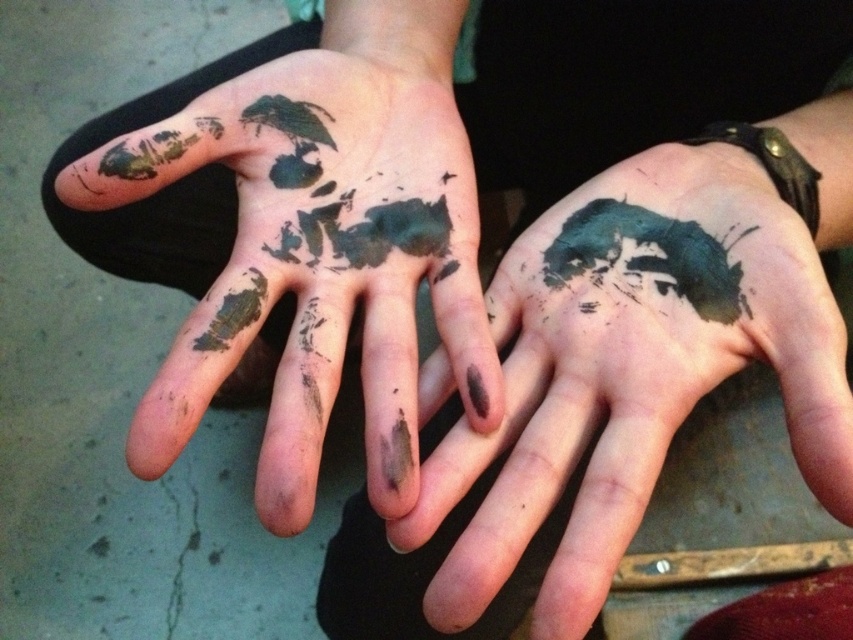
Who is taller, dark green paint at center or watercolor ink cat at center?

Standing taller between the two is dark green paint at center.

This screenshot has width=853, height=640. What do you see at coordinates (639, 362) in the screenshot? I see `dark green paint at center` at bounding box center [639, 362].

You are a GUI agent. You are given a task and a screenshot of the screen. Output one action in this format:
    pyautogui.click(x=<x>, y=<y>)
    Task: Click on the dark green paint at center
    The image size is (853, 640).
    Given the screenshot: What is the action you would take?
    pyautogui.click(x=639, y=362)

Looking at this image, between dark green textured mud at center and green matte paint splatter at center, which one is positioned higher?

Positioned higher is dark green textured mud at center.

Is dark green textured mud at center to the right of green matte paint splatter at center from the viewer's perspective?

Yes, dark green textured mud at center is to the right of green matte paint splatter at center.

Find the location of a particular element. The image size is (853, 640). dark green textured mud at center is located at coordinates (320, 257).

Locate an element on the screen. dark green textured mud at center is located at coordinates (320, 257).

Is watercolor ink cat at center shorter than green matte paint splatter at center?

No, watercolor ink cat at center is not shorter than green matte paint splatter at center.

This screenshot has height=640, width=853. Identify the location of watercolor ink cat at center. (647, 257).

Is point (549, 262) farther from camera compared to point (242, 291)?

Yes, it is.

Find the location of `watercolor ink cat at center`. watercolor ink cat at center is located at coordinates (647, 257).